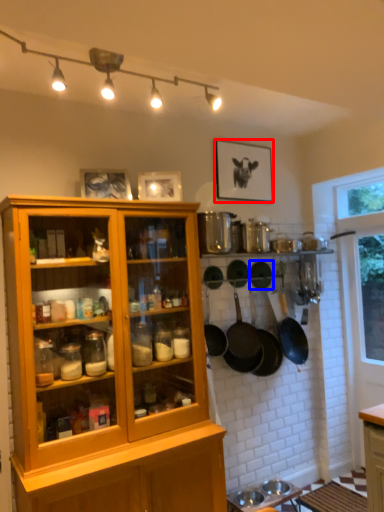
Question: Which point is further to the camera, picture frame (highlighted by a red box) or frying pan (highlighted by a blue box)?

Choices:
 (A) picture frame
 (B) frying pan

Answer: (B)